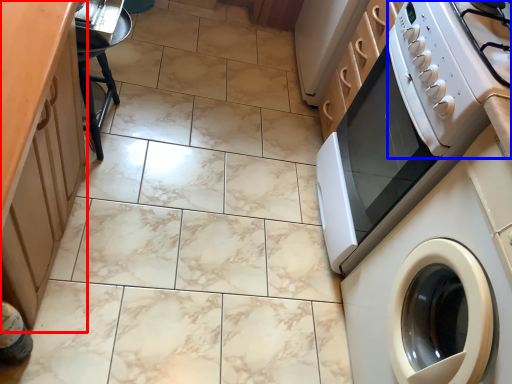
Question: Which of the following is the farthest to the observer, cabinetry (highlighted by a red box) or gas stove (highlighted by a blue box)?

Choices:
 (A) cabinetry
 (B) gas stove

Answer: (B)